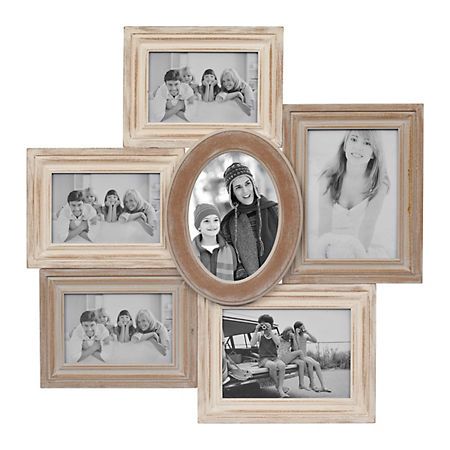
I want to click on rectangular frames, so click(x=405, y=117), click(x=364, y=303), click(x=141, y=285), click(x=141, y=166), click(x=257, y=38).